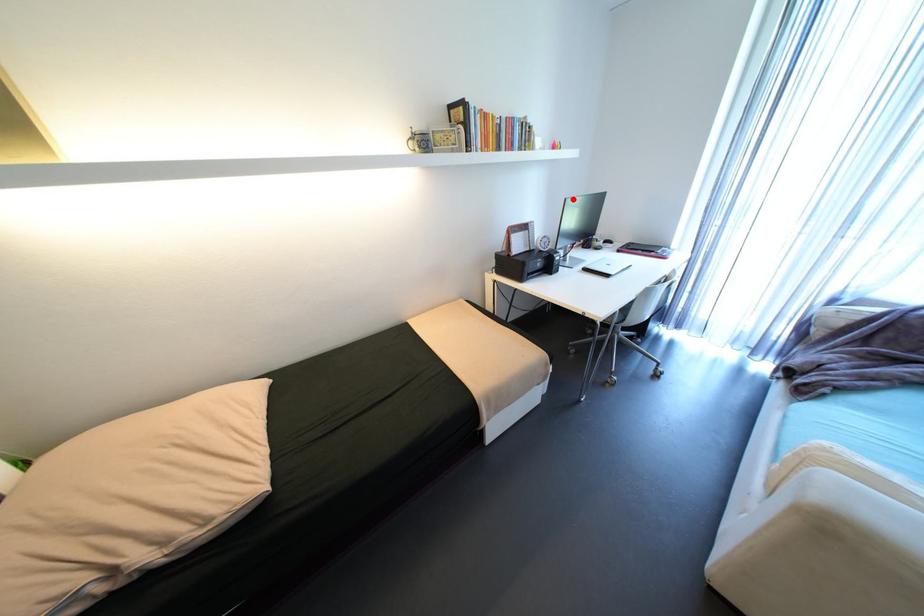
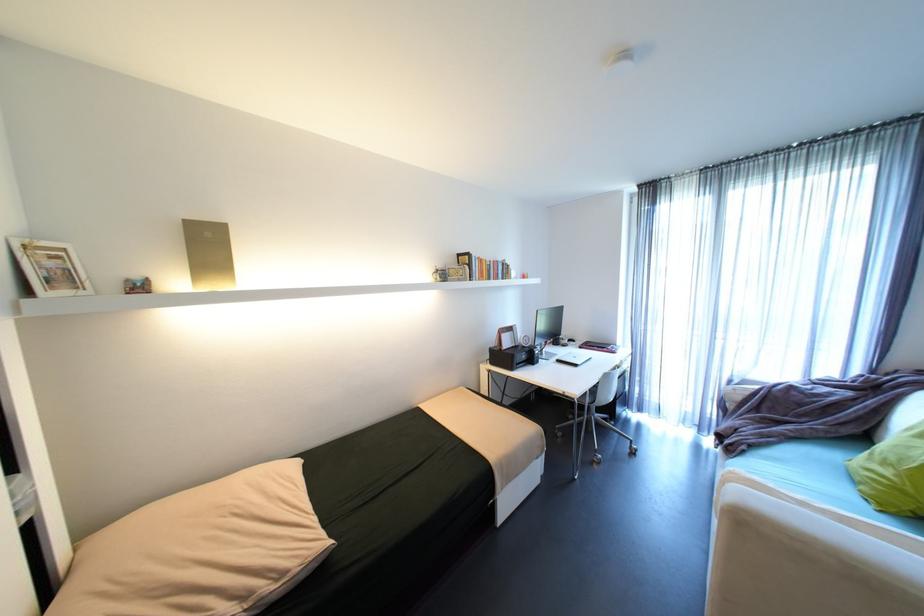
Question: I am providing you with two images of the same scene from different viewpoints. In image1, a red point is highlighted. Considering the same 3D point in image2, which of the following is correct?

Choices:
 (A) It is closer
 (B) It is farther

Answer: (B)